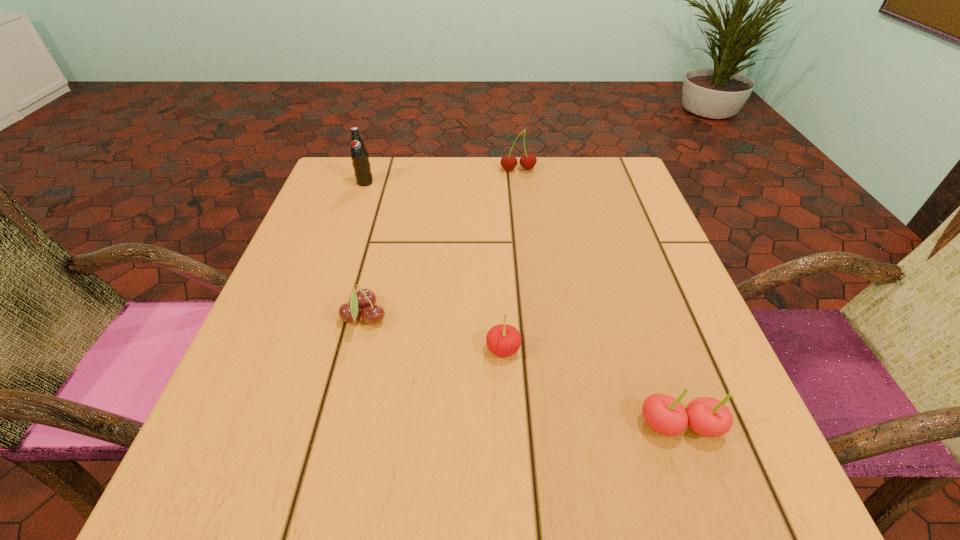
Identify the location of vacant position located on the leaves of the shortest object. This screenshot has height=540, width=960. (495, 318).

I want to click on pop located at the far edge, so click(x=360, y=159).

At what (x,y) coordinates should I click in order to perform the action: click on cherry that is at the far edge. Please return your answer as a coordinate pair (x, y). Looking at the image, I should click on (508, 162).

Locate an element on the screen. The height and width of the screenshot is (540, 960). object that is positioned at the near edge is located at coordinates (706, 416).

Identify the location of pop present at the left edge. Image resolution: width=960 pixels, height=540 pixels. (360, 159).

Where is `cherry that is positioned at the left edge`? cherry that is positioned at the left edge is located at coordinates (365, 299).

Find the location of `object that is at the right edge`. object that is at the right edge is located at coordinates (706, 416).

Locate an element on the screen. This screenshot has height=540, width=960. object located at the far left corner is located at coordinates 360,159.

Identify the location of object present at the near right corner. (706, 416).

Identify the location of vacant space at the far edge of the desktop. (412, 166).